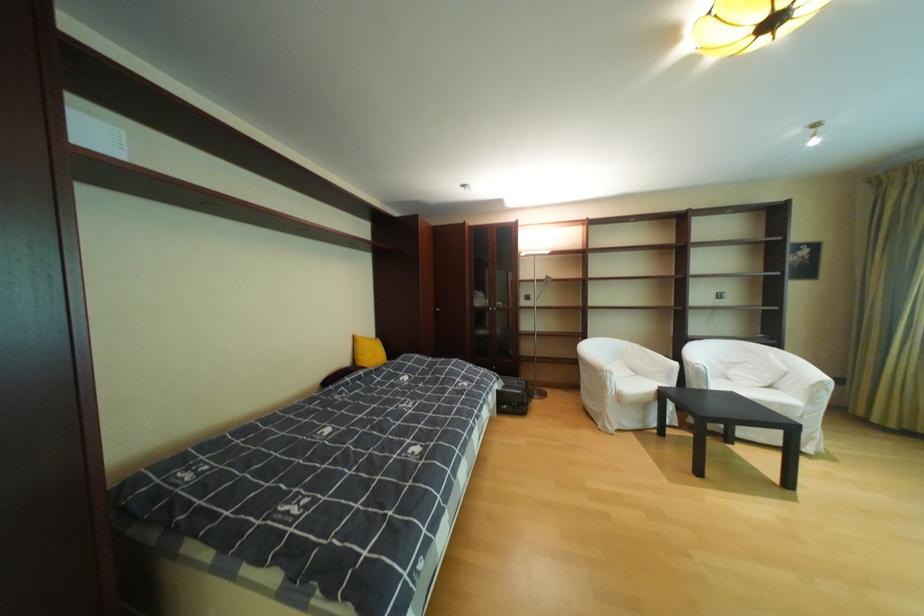
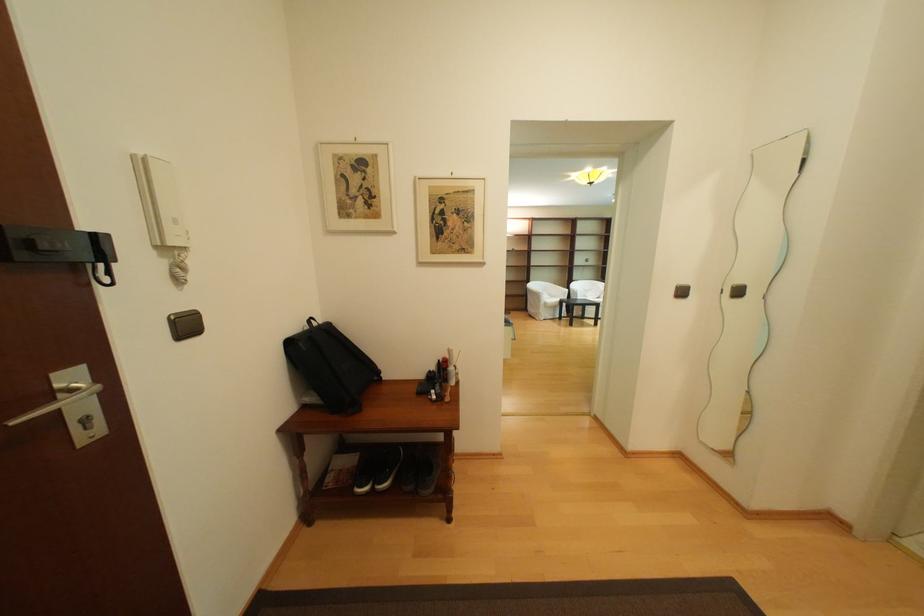
What movement of the cameraman would produce the second image?

The movement direction of the cameraman is left, backward.